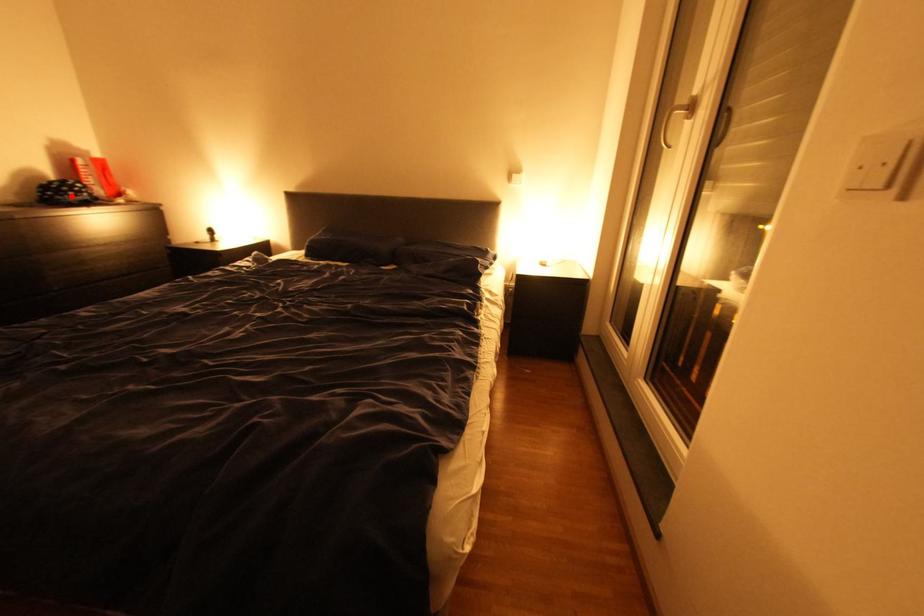
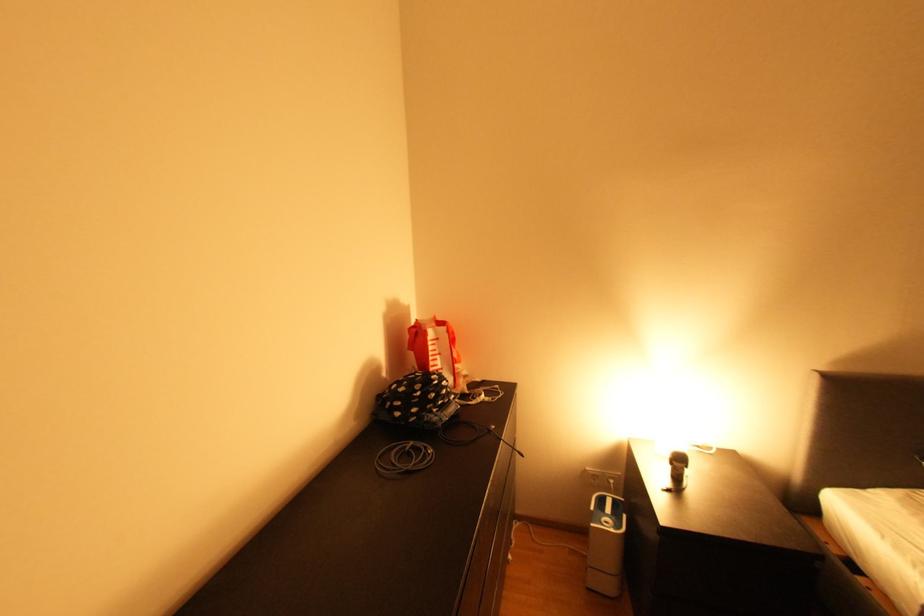
Where in the second image is the point corresponding to the highlighted location from the first image?

(441, 411)